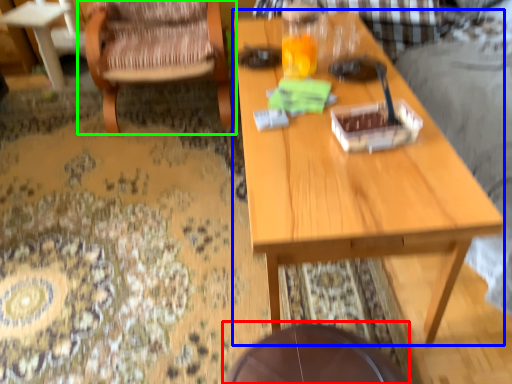
Question: Which object is the farthest from round table (highlighted by a red box)? Choose among these: table (highlighted by a blue box) or chair (highlighted by a green box).

Choices:
 (A) table
 (B) chair

Answer: (B)